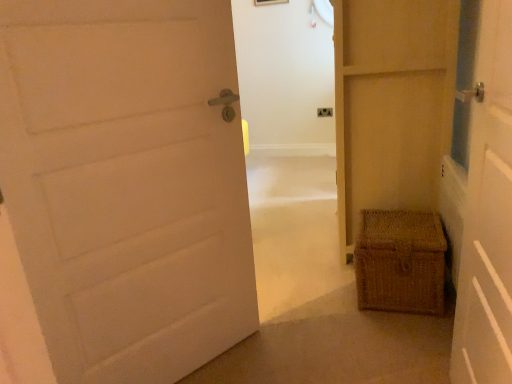
Question: Is matte beige door at center, which is the 1th door from right to left, taller than matte plastic electrical outlet at center?

Choices:
 (A) no
 (B) yes

Answer: (B)

Question: Does matte beige door at center, the third door when ordered from left to right, appear on the left side of matte plastic electrical outlet at center?

Choices:
 (A) no
 (B) yes

Answer: (A)

Question: Would you say matte plastic electrical outlet at center is part of matte beige door at center, which is the 1th door from right to left,'s contents?

Choices:
 (A) no
 (B) yes

Answer: (A)

Question: Is matte beige door at center, the third door when ordered from left to right, completely or partially outside of matte plastic electrical outlet at center?

Choices:
 (A) yes
 (B) no

Answer: (A)

Question: Considering the relative sizes of matte beige door at center, the third door when ordered from left to right, and matte plastic electrical outlet at center in the image provided, is matte beige door at center, the third door when ordered from left to right, wider than matte plastic electrical outlet at center?

Choices:
 (A) no
 (B) yes

Answer: (B)

Question: Is matte beige door at center, the third door when ordered from left to right, facing towards matte plastic electrical outlet at center?

Choices:
 (A) yes
 (B) no

Answer: (B)

Question: Is woven brown basket at right thinner than white matte door at left, the first door viewed from the left?

Choices:
 (A) yes
 (B) no

Answer: (B)

Question: Is woven brown basket at right in front of white matte door at left, the 3th door when ordered from right to left?

Choices:
 (A) yes
 (B) no

Answer: (B)

Question: Is woven brown basket at right positioned behind white matte door at left, the 3th door when ordered from right to left?

Choices:
 (A) yes
 (B) no

Answer: (A)

Question: From a real-world perspective, is woven brown basket at right physically below white matte door at left, the first door viewed from the left?

Choices:
 (A) no
 (B) yes

Answer: (B)

Question: From the image's perspective, is woven brown basket at right below white matte door at left, the first door viewed from the left?

Choices:
 (A) no
 (B) yes

Answer: (B)

Question: Is woven brown basket at right far away from white matte door at left, the 3th door when ordered from right to left?

Choices:
 (A) yes
 (B) no

Answer: (B)

Question: From the image's perspective, is wooden picture frame at upper center under matte beige door at center, the third door when ordered from left to right?

Choices:
 (A) yes
 (B) no

Answer: (B)